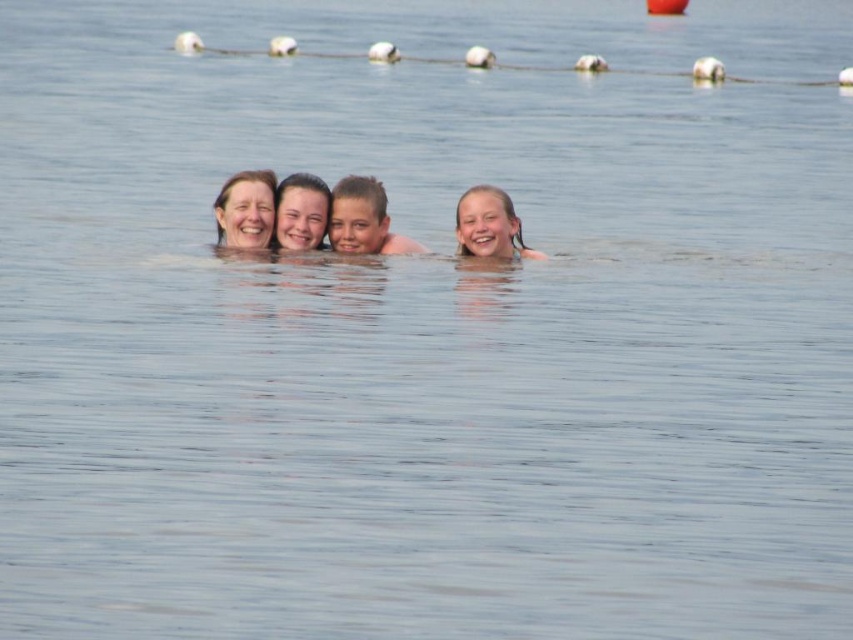
Question: Among these points, which one is nearest to the camera?

Choices:
 (A) (268, 170)
 (B) (384, 224)
 (C) (305, 234)

Answer: (A)

Question: Which of the following is the closest to the observer?

Choices:
 (A) matte skin face at center
 (B) smooth skin boy at center
 (C) matte skin at upper center

Answer: (C)

Question: Where is smooth skin boy at center located in relation to matte skin face at center in the image?

Choices:
 (A) below
 (B) above

Answer: (A)

Question: Is smooth skin boy at center to the right of smooth skin girl at upper center from the viewer's perspective?

Choices:
 (A) no
 (B) yes

Answer: (A)

Question: Is smooth skin boy at center positioned behind matte skin at upper center?

Choices:
 (A) no
 (B) yes

Answer: (B)

Question: Which point is farther from the camera taking this photo?

Choices:
 (A) (476, 205)
 (B) (390, 252)
 (C) (287, 209)
 (D) (248, 237)

Answer: (B)